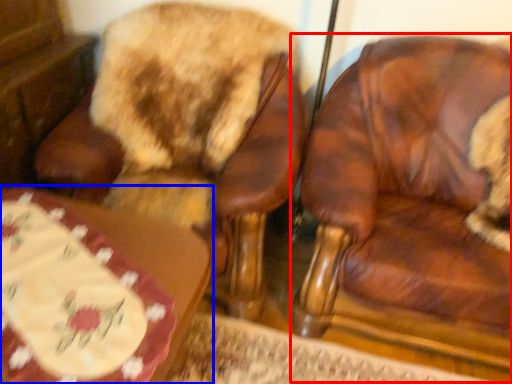
Question: Which object appears farthest to the camera in this image, chair (highlighted by a red box) or table (highlighted by a blue box)?

Choices:
 (A) chair
 (B) table

Answer: (A)